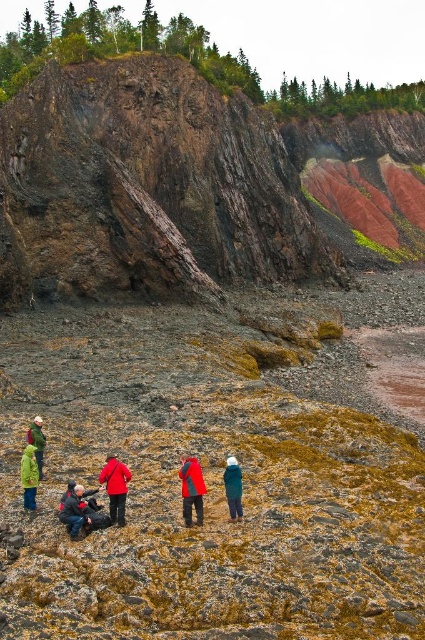
Who is lower down, red matte jacket at center or green matte jacket at lower left?

red matte jacket at center

Between point (115, 499) and point (22, 472), which one is positioned behind?

The point (22, 472) is more distant.

Locate an element on the screen. This screenshot has width=425, height=640. red matte jacket at center is located at coordinates (116, 486).

How much distance is there between red matte jacket at center and dark blue jacket at lower left?

red matte jacket at center and dark blue jacket at lower left are 3.78 feet apart from each other.

Looking at this image, is red matte jacket at center wider than dark blue jacket at lower left?

In fact, red matte jacket at center might be narrower than dark blue jacket at lower left.

Locate an element on the screen. The image size is (425, 640). red matte jacket at center is located at coordinates (116, 486).

Where is `red matte jacket at center`? The image size is (425, 640). red matte jacket at center is located at coordinates (116, 486).

Does rusty rock cliff at upper left come in front of green matte jacket at lower left?

No, rusty rock cliff at upper left is behind green matte jacket at lower left.

Can you confirm if rusty rock cliff at upper left is positioned to the left of green matte jacket at lower left?

Result: No, rusty rock cliff at upper left is not to the left of green matte jacket at lower left.

Is point (308, 241) farther from viewer compared to point (27, 452)?

Yes, it is.

Locate an element on the screen. The height and width of the screenshot is (640, 425). rusty rock cliff at upper left is located at coordinates (164, 182).